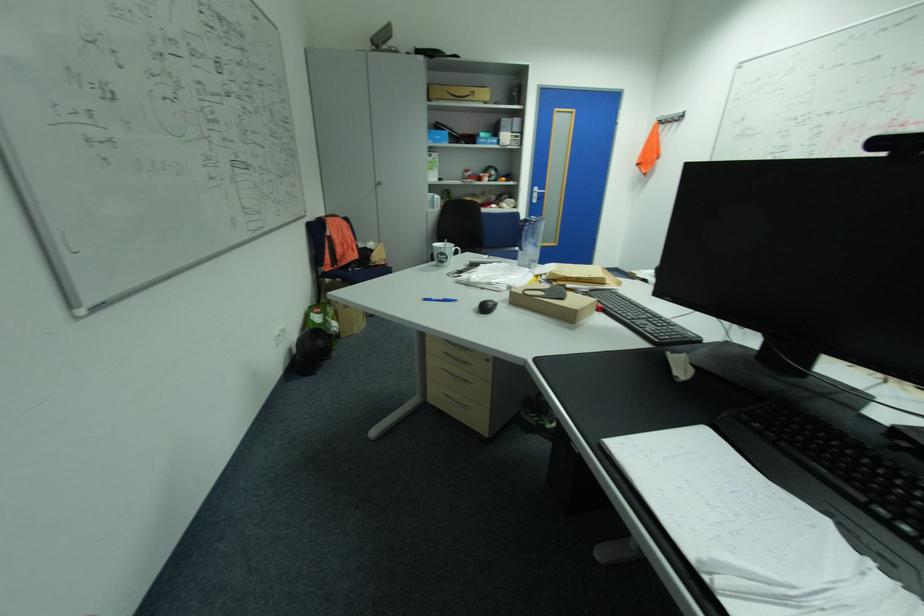
What are the coordinates of `black computer mouse` in the screenshot? It's located at (487, 306).